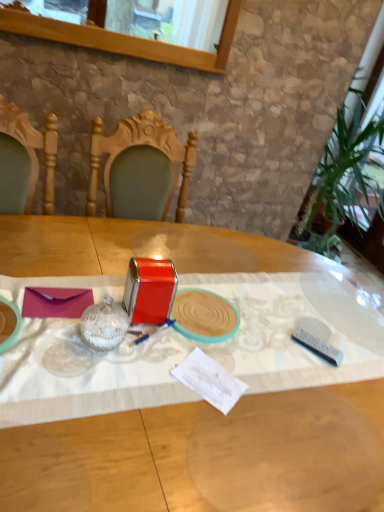
This screenshot has width=384, height=512. In order to click on vacant area in front of metallic red tin at center, the third tableware from the right in this screenshot , I will do `click(125, 364)`.